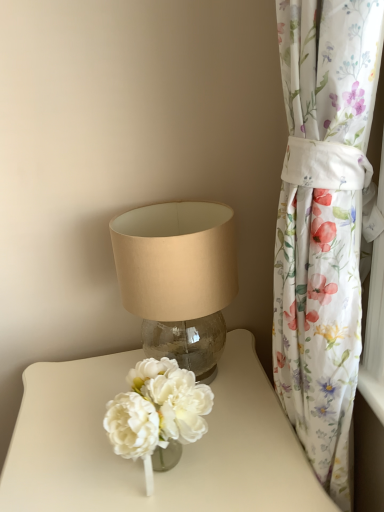
You are a GUI agent. You are given a task and a screenshot of the screen. Output one action in this format:
    pyautogui.click(x=<x>, y=<y>)
    Task: Click on the vacant area situated below beige fabric lampshade at center (from a real-world perspective)
    This screenshot has height=512, width=384.
    Given the screenshot: What is the action you would take?
    pyautogui.click(x=207, y=358)